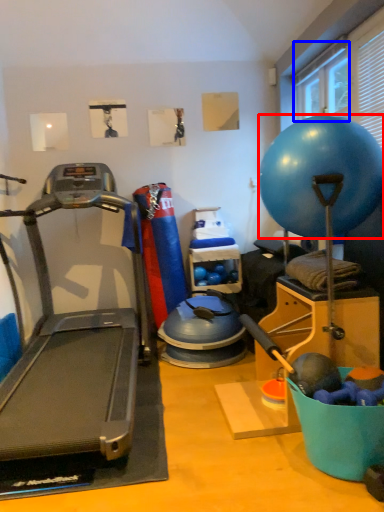
Question: Which point is closer to the camera, ball (highlighted by a red box) or window screen (highlighted by a blue box)?

Choices:
 (A) ball
 (B) window screen

Answer: (A)